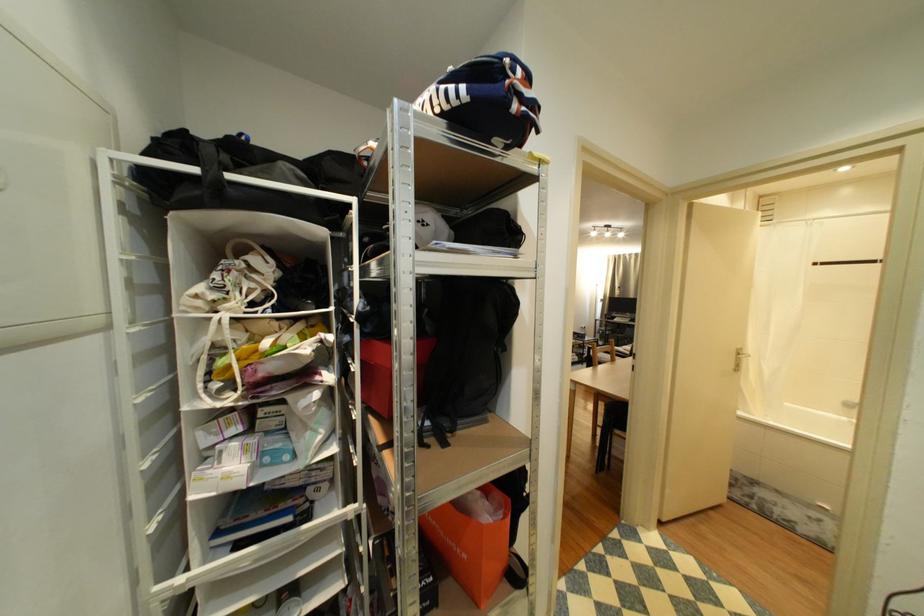
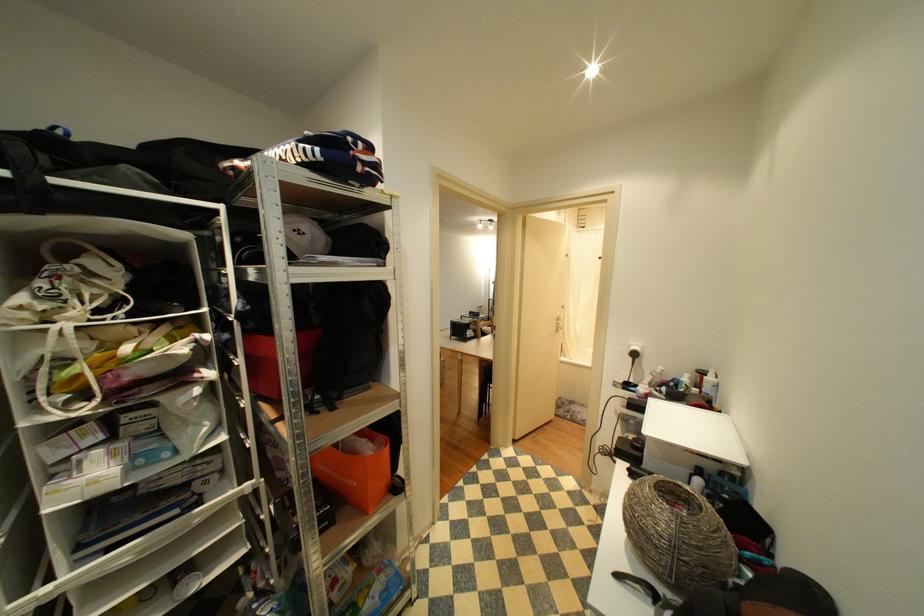
Question: Based on the continuous images, in which direction is the camera rotating? Reply with the corresponding letter.

Choices:
 (A) Left
 (B) Right
 (C) Up
 (D) Down

Answer: (B)